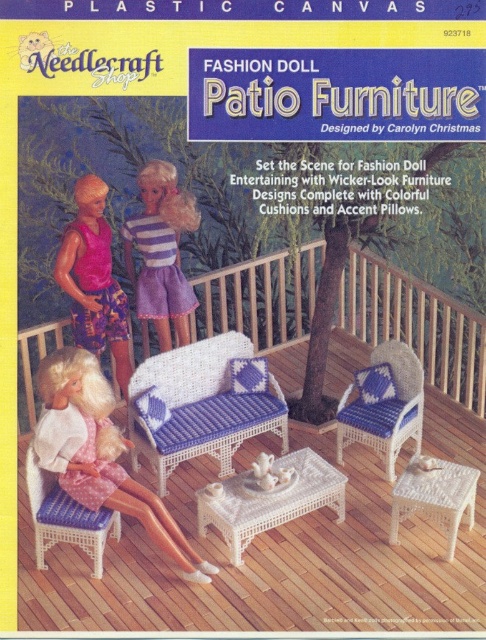
You are a fashion doll trying to reach a book on a shelf that is at the same height as the white wicker table at center. If you stand on the matte wicker stool at lower left, will you be able to reach the shelf?

The matte wicker stool at lower left has a greater height compared to the white wicker table at center. Therefore, standing on the matte wicker stool at lower left would allow you to reach the shelf at the same height as the white wicker table at center since the stool is taller than the table.

You are a fashion doll trying to reach a book on a shelf placed on the white wicker table at center. You are sitting on the wicker blue cushioned chair at center. Can you easily reach the book?

The wicker blue cushioned chair at center is much taller than the white wicker table at center, so the doll can easily reach the book on the table.